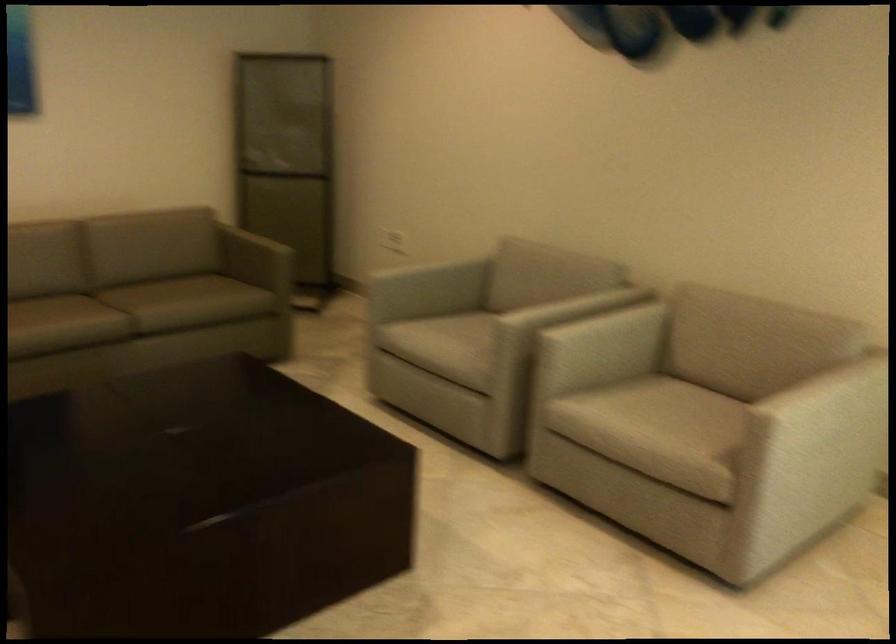
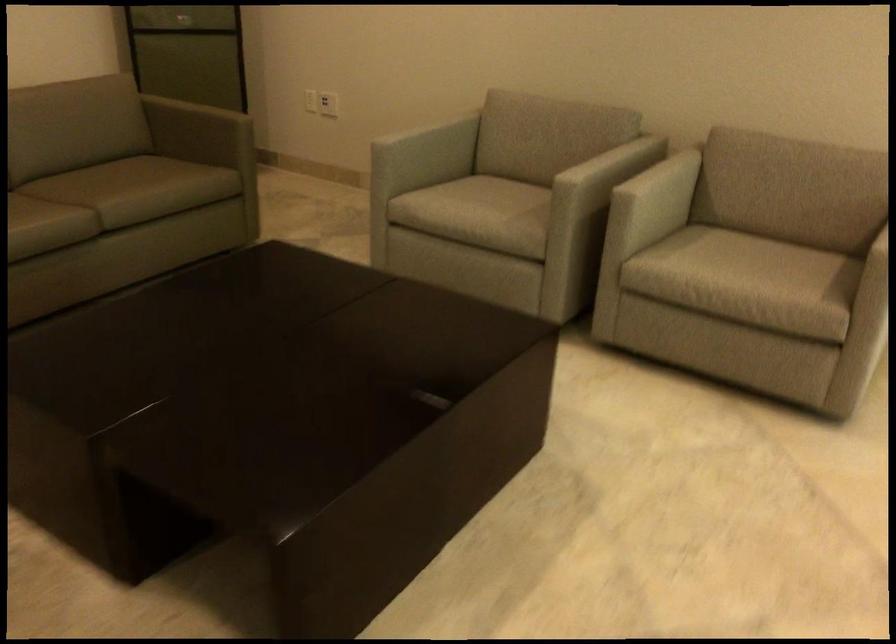
The point at (674, 411) is marked in the first image. Where is the corresponding point in the second image?

(739, 257)